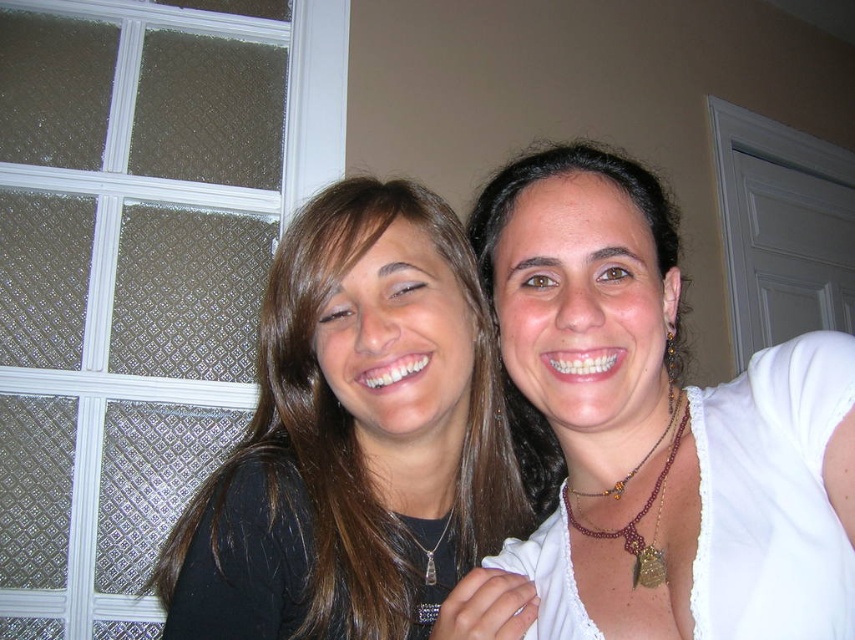
You are a photographer adjusting the camera focus. The two necklaces, the white matte necklace at upper right and the beaded burgundy necklace at upper right, are in your viewfinder. Which necklace should you focus on if you want to capture the wider one?

The white matte necklace at upper right should be focused on because its width is larger than the beaded burgundy necklace at upper right.

You are a photographer adjusting the camera focus. You need to ensure both the white matte necklace at upper right and the matte black shirt at center are in focus. Given their sizes, which object should you adjust the focus on first to accommodate their size difference?

The white matte necklace at upper right is smaller in width than the matte black shirt at center, so you should focus on the matte black shirt at center first since it is larger and requires more precise focus adjustment.